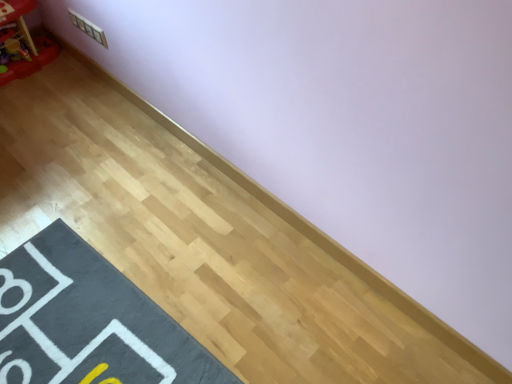
Describe the element at coordinates (21, 43) in the screenshot. I see `matte plastic toy storage at upper left` at that location.

Find the location of `matte plastic toy storage at upper left`. matte plastic toy storage at upper left is located at coordinates (21, 43).

This screenshot has height=384, width=512. In order to click on matte plastic toy storage at upper left in this screenshot , I will do `click(21, 43)`.